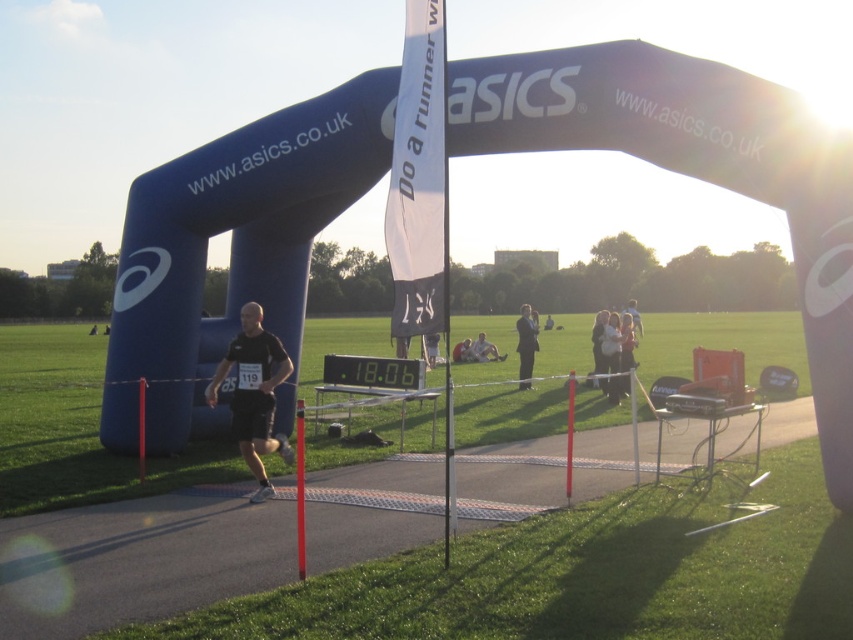
You are a participant in the race and you see the dark gray suit at center and the light brown leather jacket at upper center. Which clothing item is positioned higher from the ground?

The light brown leather jacket at upper center is positioned higher from the ground than the dark gray suit at center.

You are a photographer at the finish line and want to capture the runner crossing the line. Since the black fabric person at center is partially obscured, can you still see their black matte shorts at center in the photo?

The black matte shorts at center is positioned over black fabric person at center, so yes, the shorts are visible and can be clearly seen in the photo.